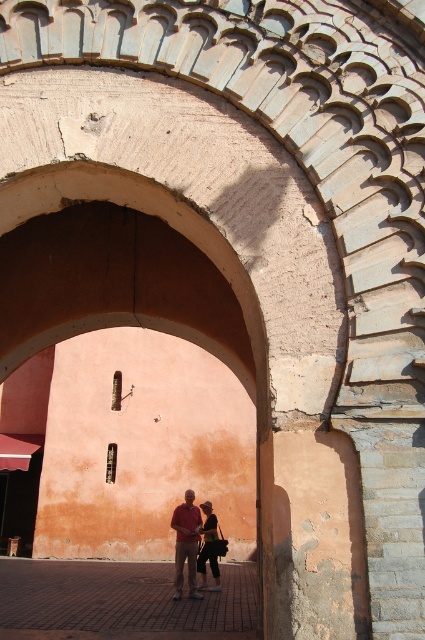
Question: Is the position of matte red shirt at center less distant than that of dark brown leather jacket at center?

Choices:
 (A) yes
 (B) no

Answer: (A)

Question: Among these points, which one is farthest from the camera?

Choices:
 (A) click(212, 572)
 (B) click(172, 518)

Answer: (B)

Question: Can you confirm if matte red shirt at center is bigger than dark brown leather jacket at center?

Choices:
 (A) yes
 (B) no

Answer: (A)

Question: Which object appears closest to the camera in this image?

Choices:
 (A) dark brown leather jacket at center
 (B) matte red shirt at center

Answer: (B)

Question: From the image, what is the correct spatial relationship of matte red shirt at center in relation to dark brown leather jacket at center?

Choices:
 (A) above
 (B) below

Answer: (B)

Question: Which point is closer to the camera taking this photo?

Choices:
 (A) (201, 557)
 (B) (184, 524)

Answer: (B)